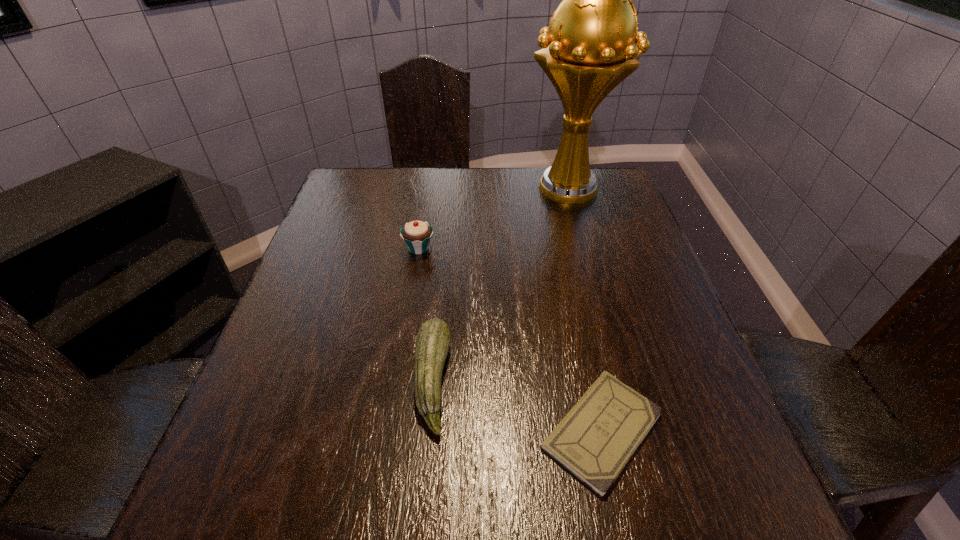
Where is `vacant region at the near right corner of the desktop`? vacant region at the near right corner of the desktop is located at coordinates (739, 512).

Image resolution: width=960 pixels, height=540 pixels. In order to click on free spot between the shortest object and the third tallest object in this screenshot , I will do `click(517, 406)`.

Where is `free area in between the farthest object and the checkbook`? Image resolution: width=960 pixels, height=540 pixels. free area in between the farthest object and the checkbook is located at coordinates (586, 310).

Where is `unoccupied position between the tallest object and the third shortest object`? The height and width of the screenshot is (540, 960). unoccupied position between the tallest object and the third shortest object is located at coordinates (493, 219).

Locate an element on the screen. Image resolution: width=960 pixels, height=540 pixels. vacant area between the zucchini and the tallest object is located at coordinates (500, 285).

Locate an element on the screen. vacant area that lies between the farthest object and the zucchini is located at coordinates (500, 285).

This screenshot has height=540, width=960. Find the location of `free space between the third nearest object and the trophy_cup`. free space between the third nearest object and the trophy_cup is located at coordinates (493, 219).

Where is `free area in between the second tallest object and the shortest object`? The image size is (960, 540). free area in between the second tallest object and the shortest object is located at coordinates pyautogui.click(x=511, y=339).

This screenshot has height=540, width=960. In order to click on free spot between the third tallest object and the third shortest object in this screenshot , I will do `click(425, 314)`.

Find the location of a particular element. This screenshot has height=540, width=960. vacant area that lies between the checkbook and the third tallest object is located at coordinates (517, 406).